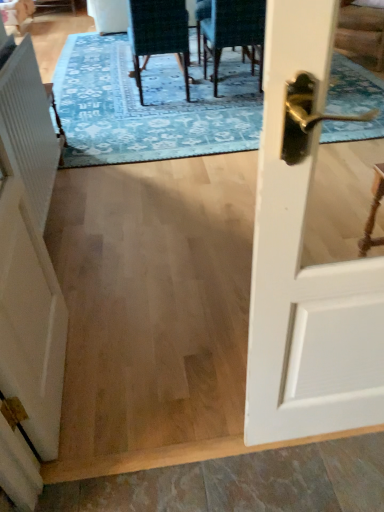
Image resolution: width=384 pixels, height=512 pixels. I want to click on free space to the back side of white matte barn door at left, so click(x=109, y=298).